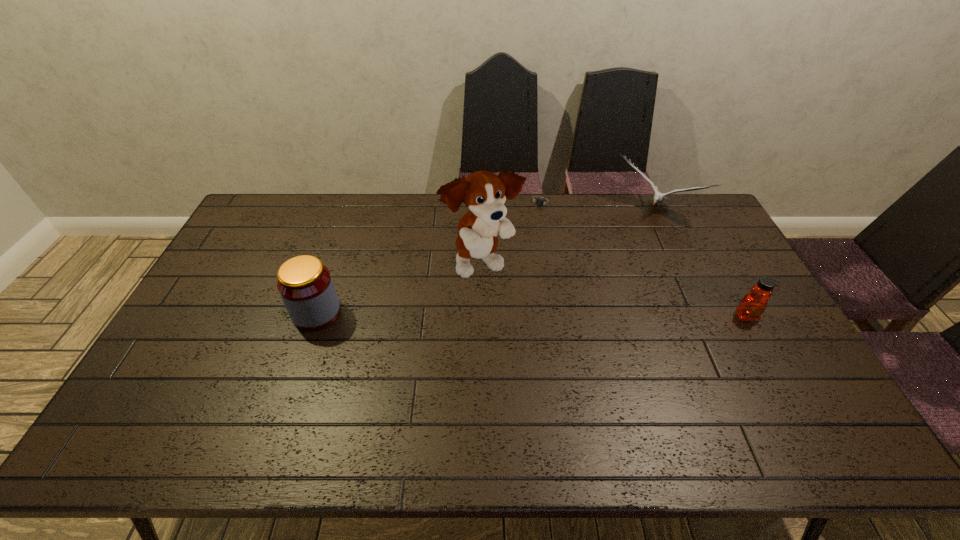
Image resolution: width=960 pixels, height=540 pixels. What are the coordinates of `free space located 0.170m on the face of the third farthest object` in the screenshot? It's located at (542, 319).

Image resolution: width=960 pixels, height=540 pixels. I want to click on blank space located on the face of the third farthest object, so click(544, 321).

What are the coordinates of `vacant point located on the face of the shortest object` in the screenshot? It's located at (521, 234).

I want to click on vacant area located 0.200m on the face of the shortest object, so click(x=516, y=242).

Locate an element on the screen. The height and width of the screenshot is (540, 960). vacant space located on the face of the shortest object is located at coordinates (510, 251).

The height and width of the screenshot is (540, 960). Identify the location of vacant space located 0.220m at the tip of the beak of the gull. (613, 261).

This screenshot has width=960, height=540. What are the coordinates of `free spot located 0.300m at the tip of the beak of the gull` in the screenshot? It's located at (604, 274).

Locate an element on the screen. free location located at the tip of the beak of the gull is located at coordinates (608, 269).

Where is `watch that is positioned at the far edge`? This screenshot has width=960, height=540. watch that is positioned at the far edge is located at coordinates (539, 202).

Locate an element on the screen. gull at the far edge is located at coordinates (658, 197).